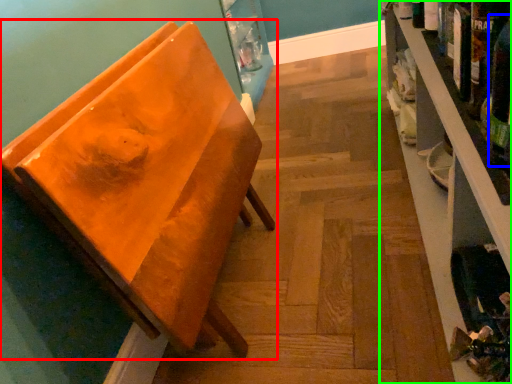
Question: Based on their relative distances, which object is nearer to furniture (highlighted by a red box)? Choose from beer bottle (highlighted by a blue box) and shelf (highlighted by a green box).

Choices:
 (A) beer bottle
 (B) shelf

Answer: (B)